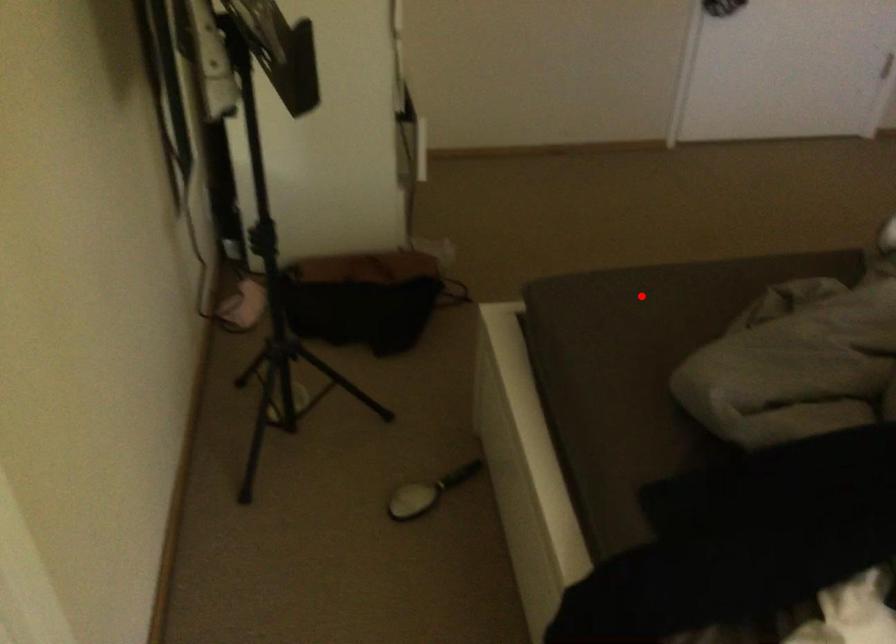
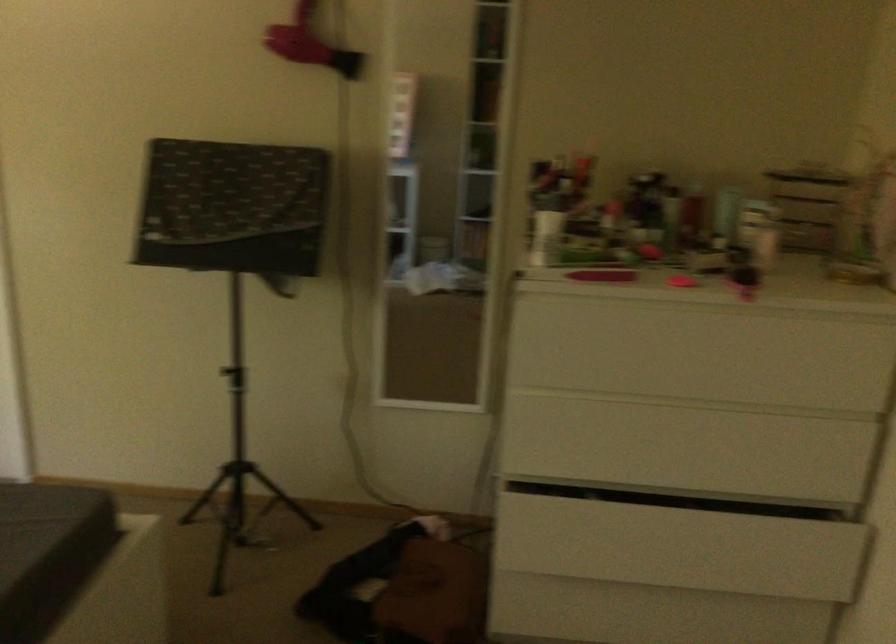
Where in the second image is the point corresponding to the highlighted location from the first image?

(38, 523)